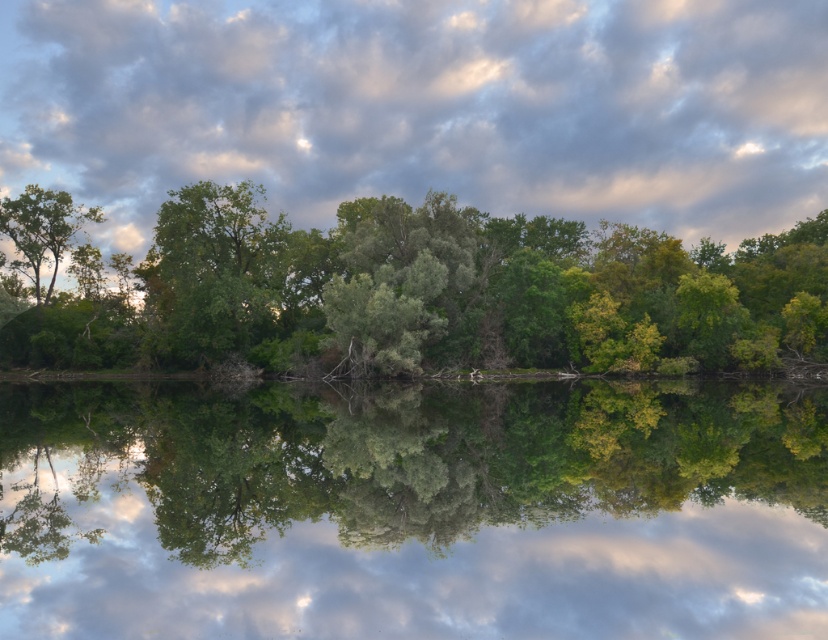
You are standing at the edge of the water and see the point labeled as point (219, 275) in the scene. Based on the description, which object is this point located on?

The point (219, 275) is located on the green leafy tree at center.

You are standing at the edge of a lake and see the green leafy trees at center. If you want to take a photo of them with your camera, will you need to zoom in or zoom out to frame them properly?

The green leafy trees at center are 194.09 feet away from the camera. Since this distance is quite far, you would need to zoom in to frame them properly.

You are standing at the point with coordinates 0.5, 0.5 in the image. You want to walk towards the green leafy river at center. In which direction should you move?

Since the green leafy river at center is located at point (414, 509), which is to the right of your current position at (414, 320), you should move to the right to reach it.